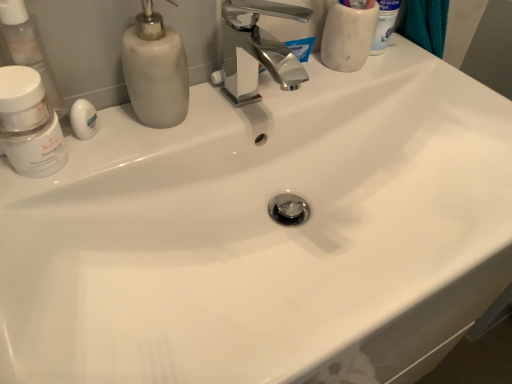
Find the location of a particular element. The image size is (512, 384). free spot in front of white marble cup at upper right, placed as the 1th toiletry when sorted from right to left is located at coordinates (326, 92).